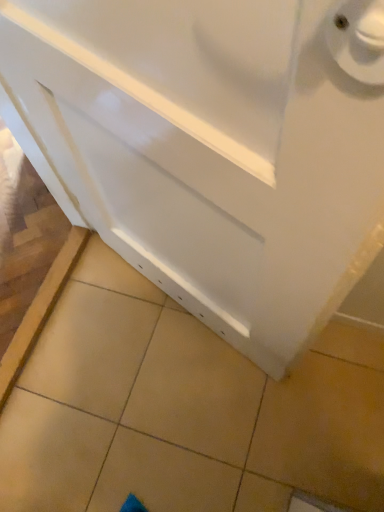
Where is `vacant space underneath white glossy door at center (from a real-world perspective)`? The width and height of the screenshot is (384, 512). vacant space underneath white glossy door at center (from a real-world perspective) is located at coordinates (184, 316).